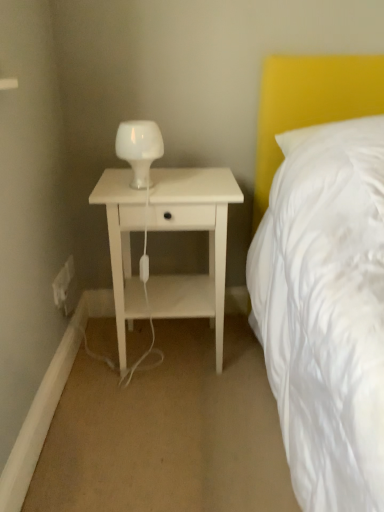
This screenshot has height=512, width=384. Identify the location of vacant area situated to the left side of white glass lamp at center. (111, 185).